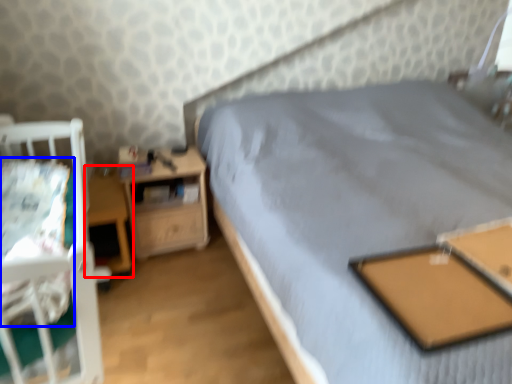
Question: Which object appears farthest to the camera in this image, table (highlighted by a red box) or sheet (highlighted by a blue box)?

Choices:
 (A) table
 (B) sheet

Answer: (A)